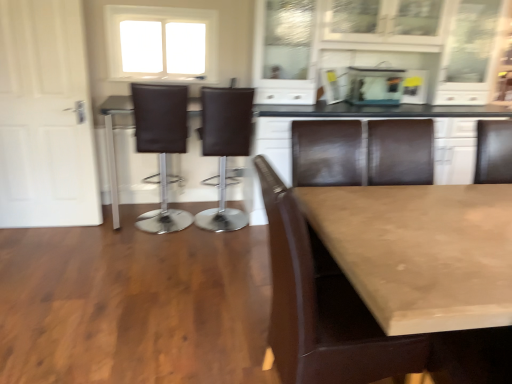
Question: From their relative heights in the image, would you say white frosted glass window at upper center is taller or shorter than brown leather bar stool at center, positioned as the second chair in back-to-front order?

Choices:
 (A) short
 (B) tall

Answer: (A)

Question: Based on their positions, is white frosted glass window at upper center located to the left or right of brown leather bar stool at center, positioned as the second chair in back-to-front order?

Choices:
 (A) left
 (B) right

Answer: (A)

Question: Estimate the real-world distances between objects in this image. Which object is farther from the brown leather chair at center, which appears as the second chair when viewed from the right?

Choices:
 (A) brown leather chair at center, the third chair when ordered from left to right
 (B) smooth beige table at center
 (C) white matte door at left
 (D) brown leather bar stool at center, marked as the first chair in a left-to-right arrangement
 (E) transparent glass aquarium at upper center

Answer: (A)

Question: Considering the real-world distances, which object is farthest from the white frosted glass window at upper center?

Choices:
 (A) brown leather chair at center, which appears as the second chair when viewed from the right
 (B) smooth beige table at center
 (C) brown leather chair at center, the first chair positioned from the front
 (D) white matte door at left
 (E) brown leather bar stool at center, which is the 2th chair in front-to-back order

Answer: (C)